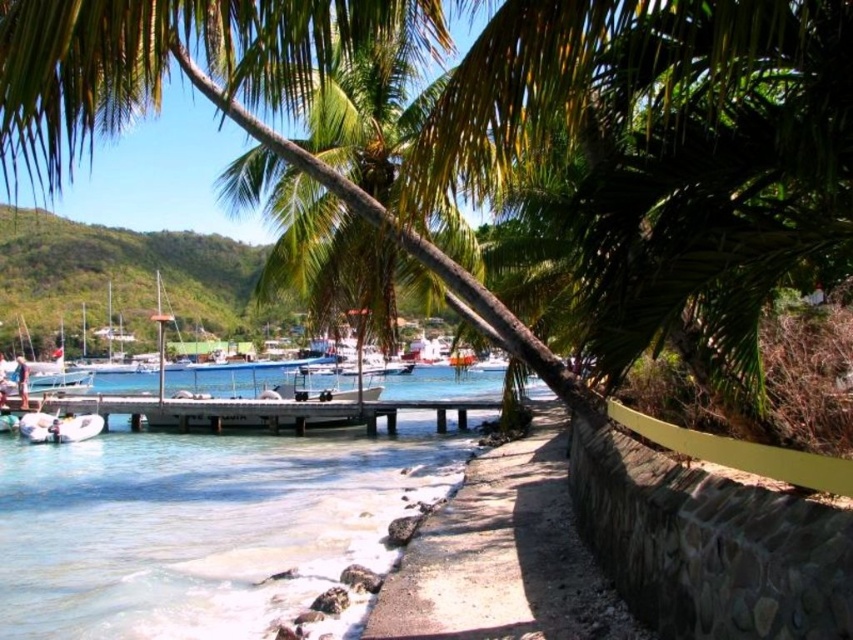
Can you confirm if stone wall at lower right is positioned to the right of wooden pier at center?

Indeed, stone wall at lower right is positioned on the right side of wooden pier at center.

Consider the image. Can you confirm if stone wall at lower right is shorter than wooden pier at center?

Correct, stone wall at lower right is not as tall as wooden pier at center.

Does point (482, 595) come behind point (193, 417)?

No, it is in front of (193, 417).

You are a GUI agent. You are given a task and a screenshot of the screen. Output one action in this format:
    pyautogui.click(x=<x>, y=<y>)
    Task: Click on the stone wall at lower right
    
    Given the screenshot: What is the action you would take?
    (x=503, y=554)

Can you confirm if stone wall at lower right is thinner than white rubber boat at lower left?

No, stone wall at lower right is not thinner than white rubber boat at lower left.

Who is more forward, (532,532) or (73,428)?

Point (532,532) is in front.

What are the coordinates of `stone wall at lower right` in the screenshot? It's located at (503, 554).

Which is above, wooden pier at center or white rubber boat at lower left?

wooden pier at center is higher up.

Does wooden pier at center have a lesser width compared to white rubber boat at lower left?

Incorrect, wooden pier at center's width is not less than white rubber boat at lower left's.

Does point (229, 406) come closer to viewer compared to point (86, 420)?

No, (229, 406) is behind (86, 420).

Locate an element on the screen. wooden pier at center is located at coordinates (253, 412).